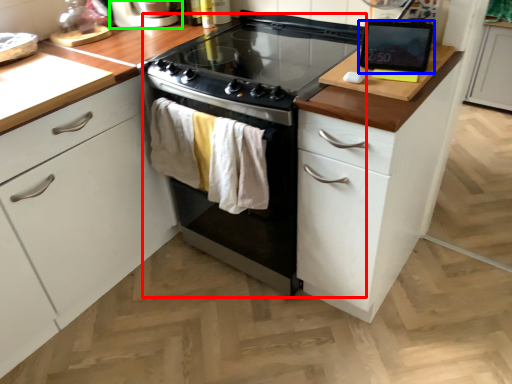
Question: Which object is positioned closest to oven (highlighted by a red box)? Select from kitchen appliance (highlighted by a blue box) and home appliance (highlighted by a green box).

Choices:
 (A) kitchen appliance
 (B) home appliance

Answer: (A)